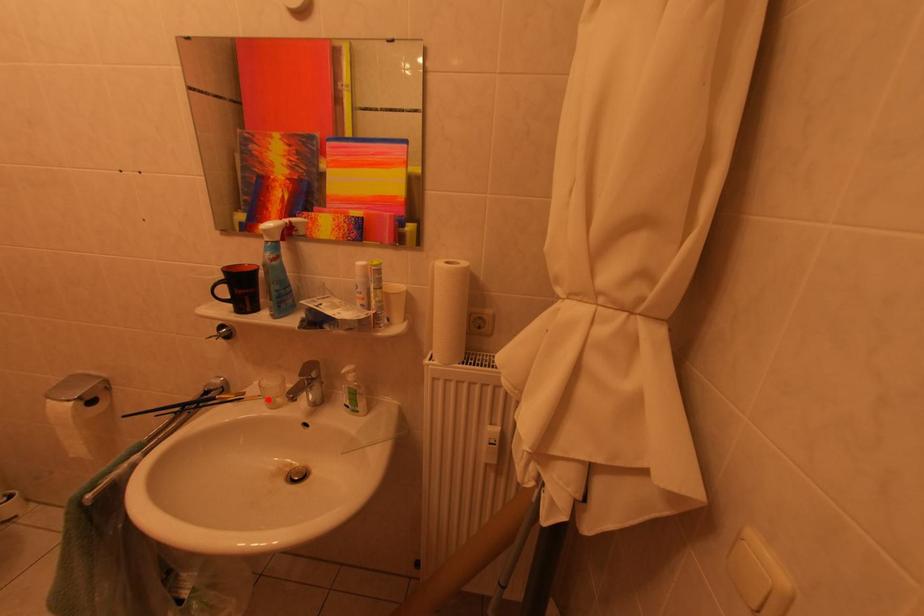
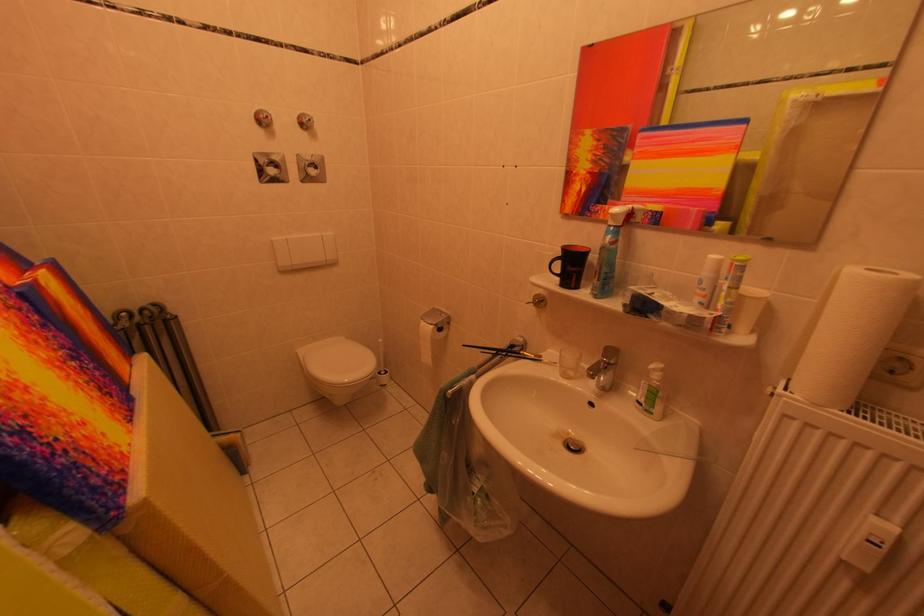
Locate, in the second image, the point that corresponds to the highlighted location in the first image.

(563, 367)